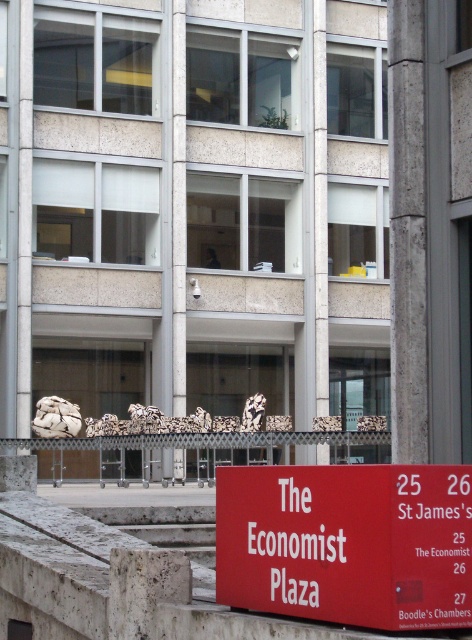
You are standing in front of the building and see the metallic silver rail at center and the white marble pillar at center. Which object is positioned to the left from your perspective?

The metallic silver rail at center is positioned to the left of the white marble pillar at center.

You are a visitor approaching the building and notice the red matte sign at lower center and the metallic silver rail at center. Which object is narrower?

The red matte sign at lower center has a lesser width compared to the metallic silver rail at center, so the red matte sign at lower center is narrower.

You are standing at the red matte sign at lower center and want to reach the metallic silver rail at center. Given that the distance between them is 15.87 meters, can you estimate how many steps it would take if each step covers approximately 0.75 meters?

The distance between the red matte sign at lower center and the metallic silver rail at center is 15.87 meters. If each step covers 0.75 meters, dividing 15.87 by 0.75 gives approximately 21.16 steps. Therefore, it would take around 21 steps to reach the metallic silver rail at center from the red matte sign at lower center.